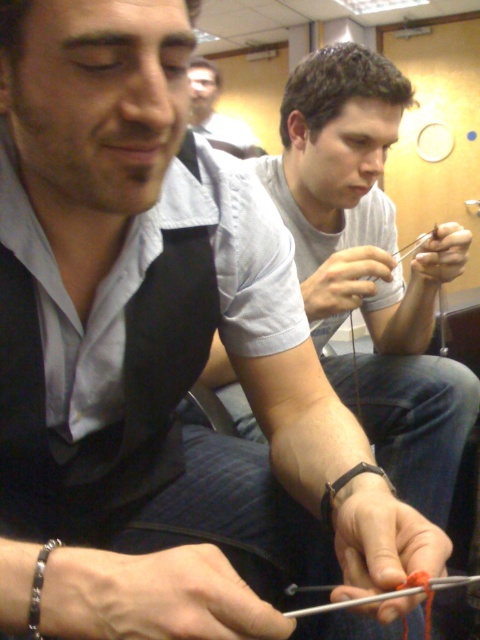
You are a fashion designer observing two gray shirts in the image. The gray matte shirt at center and the gray striped shirt at upper center. Which one is taller?

The gray matte shirt at center is taller than the gray striped shirt at upper center.

You are a tailor trying to fit a customer with a shirt. The customer has a 40 cm torso. You have two shirts available in the image. Which shirt between the gray matte shirt at center and the gray striped shirt at upper center would you recommend based on their sizes?

The gray matte shirt at center has a larger width than the gray striped shirt at upper center. Since the customer has a 40 cm torso, the gray matte shirt at center would be more suitable as it provides a better fit for a larger torso.

You are a photographer trying to capture a closeup of the gray matte shirt at center and the gray striped shirt at upper center. Which of the two shirts should you focus on first if you want to ensure both are in focus without moving the camera?

You should focus on the gray striped shirt at upper center first because it is farther away from the camera than the gray matte shirt at center, which is closer. By focusing on the farther shirt, the closer one will also be in focus due to the depth of field.